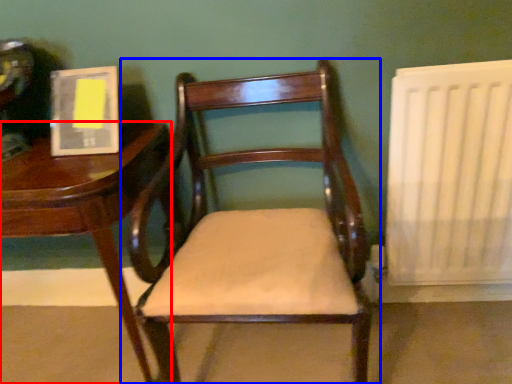
Question: Which of the following is the closest to the observer, table (highlighted by a red box) or chair (highlighted by a blue box)?

Choices:
 (A) table
 (B) chair

Answer: (B)